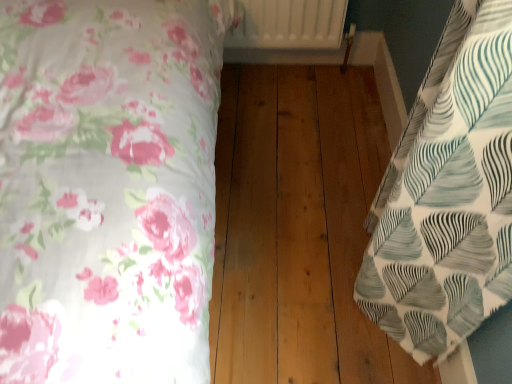
Question: Considering the relative positions of white textured fabric at right, which is counted as the first bed, starting from the right, and white matte radiator at upper center in the image provided, is white textured fabric at right, which is counted as the first bed, starting from the right, to the left of white matte radiator at upper center from the viewer's perspective?

Choices:
 (A) yes
 (B) no

Answer: (B)

Question: Is white textured fabric at right, which is counted as the first bed, starting from the right, looking in the opposite direction of white matte radiator at upper center?

Choices:
 (A) no
 (B) yes

Answer: (A)

Question: From a real-world perspective, does white textured fabric at right, the second bed when ordered from left to right, sit lower than white matte radiator at upper center?

Choices:
 (A) no
 (B) yes

Answer: (B)

Question: Does white textured fabric at right, which is counted as the first bed, starting from the right, have a greater height compared to white matte radiator at upper center?

Choices:
 (A) yes
 (B) no

Answer: (B)

Question: From the image's perspective, is white textured fabric at right, the second bed when ordered from left to right, over white matte radiator at upper center?

Choices:
 (A) no
 (B) yes

Answer: (A)

Question: From a real-world perspective, is white textured fabric at right, the second bed when ordered from left to right, over white matte radiator at upper center?

Choices:
 (A) yes
 (B) no

Answer: (B)

Question: Does white floral fabric at left, acting as the first bed starting from the left, appear on the right side of white matte radiator at upper center?

Choices:
 (A) no
 (B) yes

Answer: (A)

Question: Is white floral fabric at left, which appears as the 2th bed when viewed from the right, surrounding white matte radiator at upper center?

Choices:
 (A) yes
 (B) no

Answer: (B)

Question: From a real-world perspective, is white floral fabric at left, acting as the first bed starting from the left, beneath white matte radiator at upper center?

Choices:
 (A) no
 (B) yes

Answer: (A)

Question: Considering the relative sizes of white floral fabric at left, which appears as the 2th bed when viewed from the right, and white matte radiator at upper center in the image provided, is white floral fabric at left, which appears as the 2th bed when viewed from the right, smaller than white matte radiator at upper center?

Choices:
 (A) no
 (B) yes

Answer: (A)

Question: Does white floral fabric at left, which appears as the 2th bed when viewed from the right, appear on the left side of white matte radiator at upper center?

Choices:
 (A) yes
 (B) no

Answer: (A)

Question: Is white floral fabric at left, acting as the first bed starting from the left, positioned beyond the bounds of white matte radiator at upper center?

Choices:
 (A) yes
 (B) no

Answer: (A)

Question: Can you confirm if white textured fabric at right, the second bed when ordered from left to right, is positioned to the right of white floral fabric at left, acting as the first bed starting from the left?

Choices:
 (A) yes
 (B) no

Answer: (A)